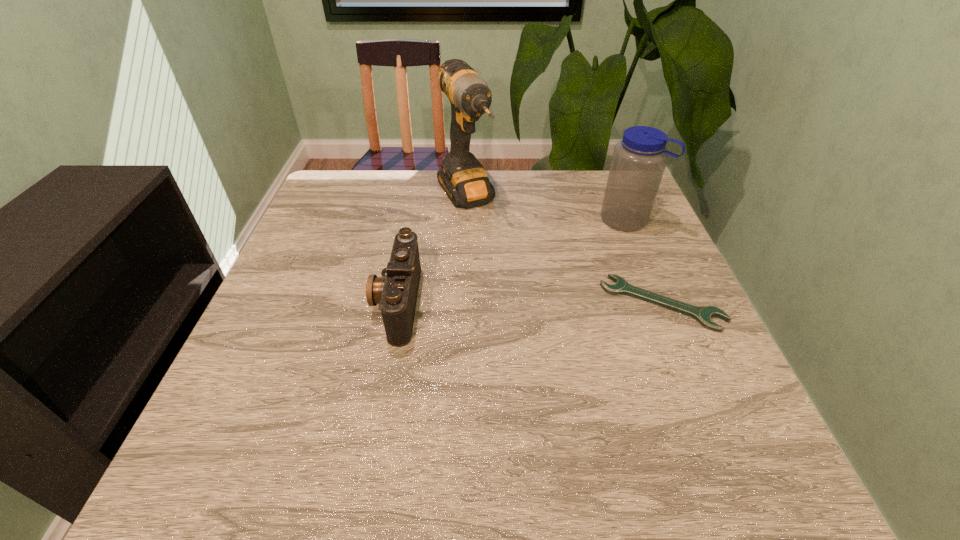
Locate an element on the screen. Image resolution: width=960 pixels, height=540 pixels. free space on the desktop that is between the second shortest object and the shortest object and is positioned with a carrying loop on the side of the third shortest object is located at coordinates (522, 303).

This screenshot has width=960, height=540. In order to click on vacant spot on the desktop that is between the camera and the shortest object and is positioned with the drill bit of the second object from left to right facing forward in this screenshot , I will do `click(546, 303)`.